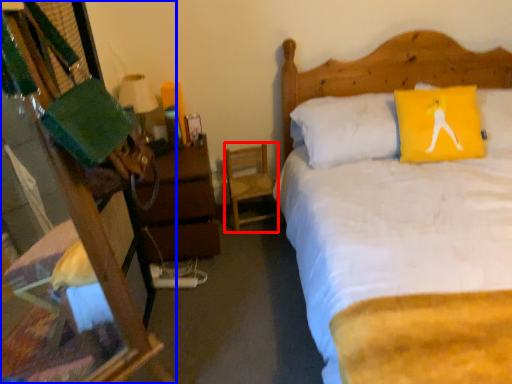
Question: Which object appears farthest to the camera in this image, chair (highlighted by a red box) or desk (highlighted by a blue box)?

Choices:
 (A) chair
 (B) desk

Answer: (A)